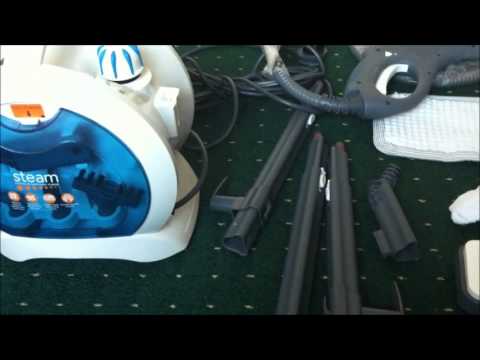
What are the coordinates of `white dot on carpet` in the screenshot? It's located at (215, 276).